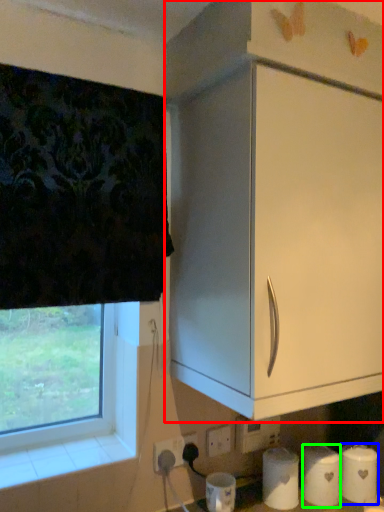
Question: Based on their relative distances, which object is farther from cabinetry (highlighted by a red box)? Choose from toilet paper (highlighted by a blue box) and toilet paper (highlighted by a green box).

Choices:
 (A) toilet paper
 (B) toilet paper

Answer: (A)